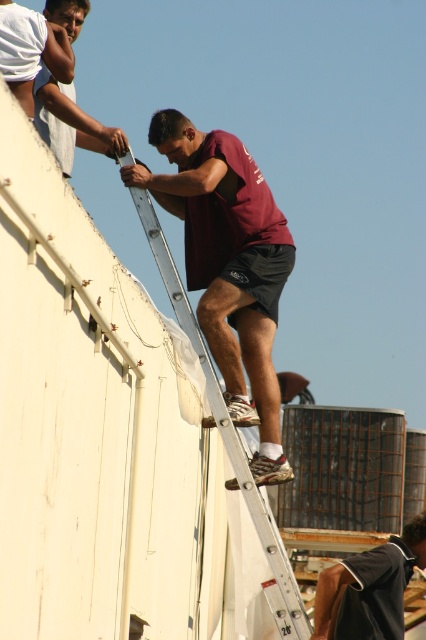
Does silver metallic ladder at upper center have a lesser width compared to dark blue jersey at upper center?

No.

Between point (155, 214) and point (394, 634), which one is positioned in front?

Positioned in front is point (155, 214).

Is point (276, 614) positioned behind point (374, 582)?

No, (276, 614) is in front of (374, 582).

The width and height of the screenshot is (426, 640). In order to click on silver metallic ladder at upper center in this screenshot , I will do `click(230, 440)`.

Is silver metallic ladder at upper center shorter than matte white shirt at upper left?

In fact, silver metallic ladder at upper center may be taller than matte white shirt at upper left.

Which is in front, point (296, 596) or point (60, 22)?

Point (296, 596) is more forward.

Find the location of a particular element. The image size is (426, 640). silver metallic ladder at upper center is located at coordinates (230, 440).

Is the position of dark blue jersey at upper center less distant than that of matte white shirt at upper left?

No, it is behind matte white shirt at upper left.

Which is behind, point (371, 576) or point (75, 106)?

The point (371, 576) is behind.

This screenshot has width=426, height=640. Find the location of `dark blue jersey at upper center`. dark blue jersey at upper center is located at coordinates (370, 588).